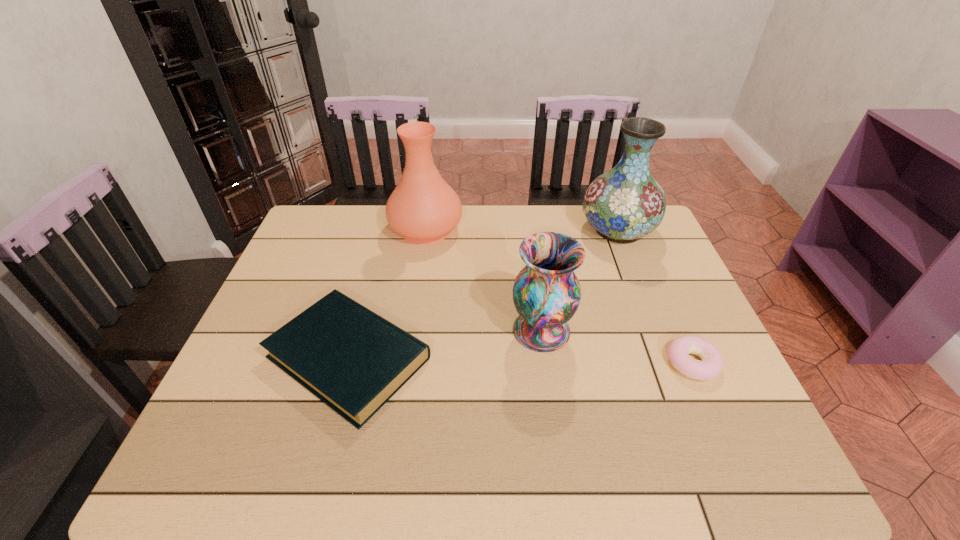
This screenshot has width=960, height=540. I want to click on the rightmost vase, so click(626, 203).

Find the location of a particular element. the leftmost vase is located at coordinates (423, 208).

You are a GUI agent. You are given a task and a screenshot of the screen. Output one action in this format:
    pyautogui.click(x=<x>, y=<y>)
    Task: Click on the third shortest object
    
    Given the screenshot: What is the action you would take?
    pyautogui.click(x=546, y=293)

This screenshot has height=540, width=960. Identify the location of the nearest vase. (546, 293).

The image size is (960, 540). In order to click on the second shortest object in this screenshot , I will do `click(352, 359)`.

I want to click on doughnut, so click(710, 367).

I want to click on vacant position located 0.090m on the front of the rightmost vase, so 635,273.

The image size is (960, 540). I want to click on free space located 0.140m on the left of the leftmost vase, so click(346, 229).

Locate an element on the screen. This screenshot has width=960, height=540. free point located 0.130m on the left of the second vase from left to right is located at coordinates (458, 330).

This screenshot has height=540, width=960. Find the location of `free space located 0.240m on the right of the second shortest object`. free space located 0.240m on the right of the second shortest object is located at coordinates (534, 357).